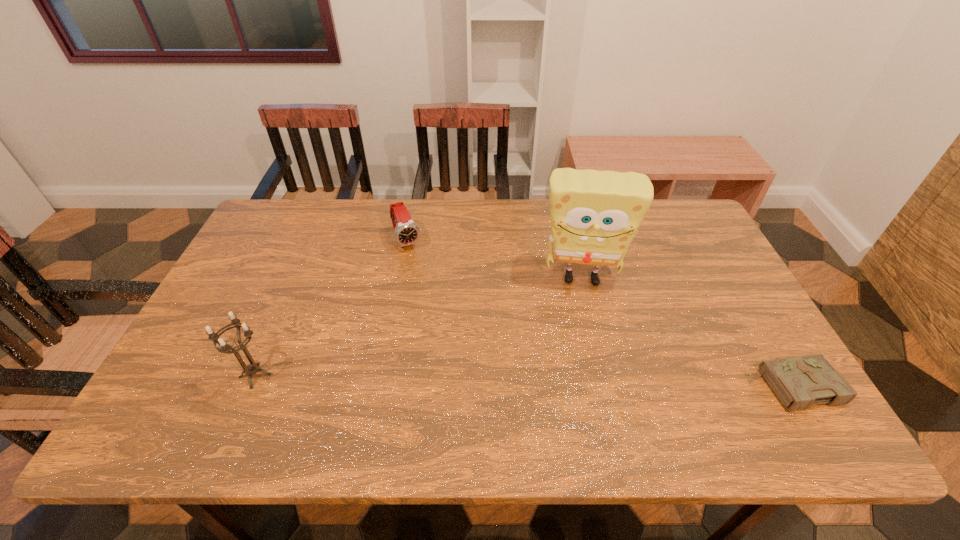
In order to click on object that ranks as the second closest to the farthest object in this screenshot , I will do click(251, 369).

This screenshot has height=540, width=960. In order to click on the second closest object relative to the second object from left to right in this screenshot , I will do `click(251, 369)`.